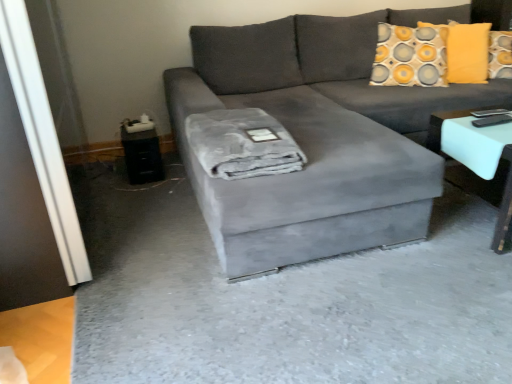
Locate an element on the screen. Image resolution: width=512 pixels, height=384 pixels. free space to the left of black plastic side table at lower left is located at coordinates (105, 175).